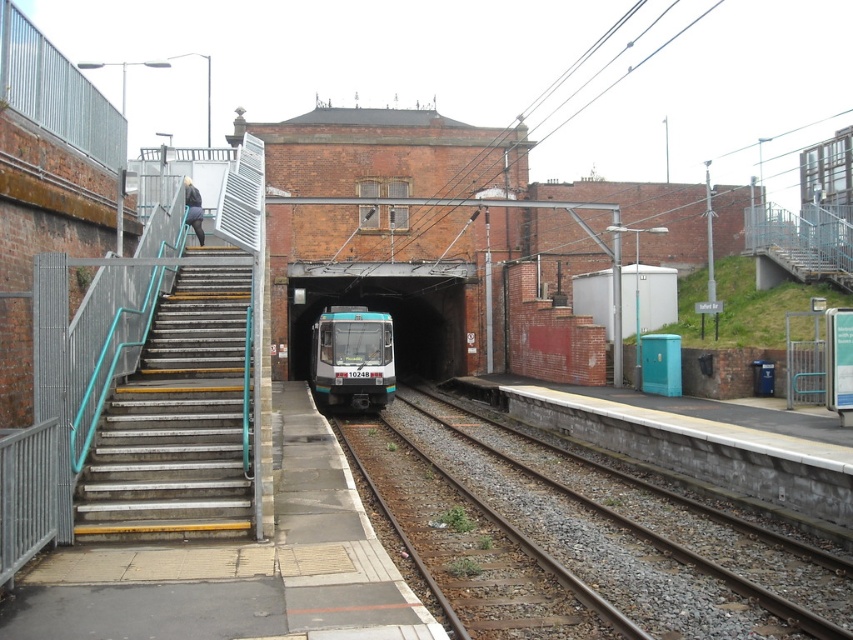
You are a passenger waiting at the station and see the teal glass train at center and the teal glossy train at center. Which one is closer to you?

The teal glass train at center is closer to you because the teal glossy train at center is behind it.

You are standing at the railway station and want to locate the smooth concrete tracks at center. According to the coordinates provided, where should you look?

The smooth concrete tracks at center are located at coordinates point (579,541).